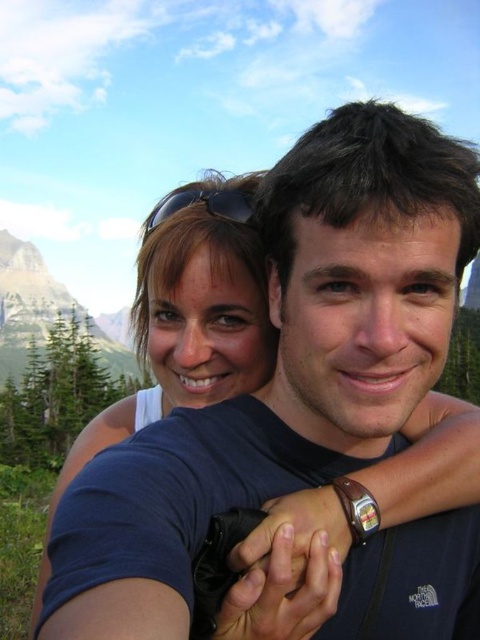
You are a photographer trying to capture a landscape photo. You notice the green forested mountain at upper left and the black matte sunglasses at upper center in your frame. Which object occupies more horizontal space in the image?

The green forested mountain at upper left occupies more horizontal space in the image because its width is larger than that of the black matte sunglasses at upper center.

You are a photographer standing at the scene described. You want to take a closeup shot of the matte white shirt at upper center. Given that your camera has a maximum zoom range of 150 feet, will you be able to capture a clear closeup without moving closer?

The matte white shirt at upper center is 162.75 feet from viewer. Since the camera can only zoom up to 150 feet, you cannot capture a clear closeup without moving closer.

You are a photographer taking a picture of the green forested mountain at upper left and the black matte sunglasses at upper center. Based on their positions in the image, which object is closer to the bottom edge of the photo?

The green forested mountain at upper left is closer to the bottom edge of the photo because it is located below the black matte sunglasses at upper center.